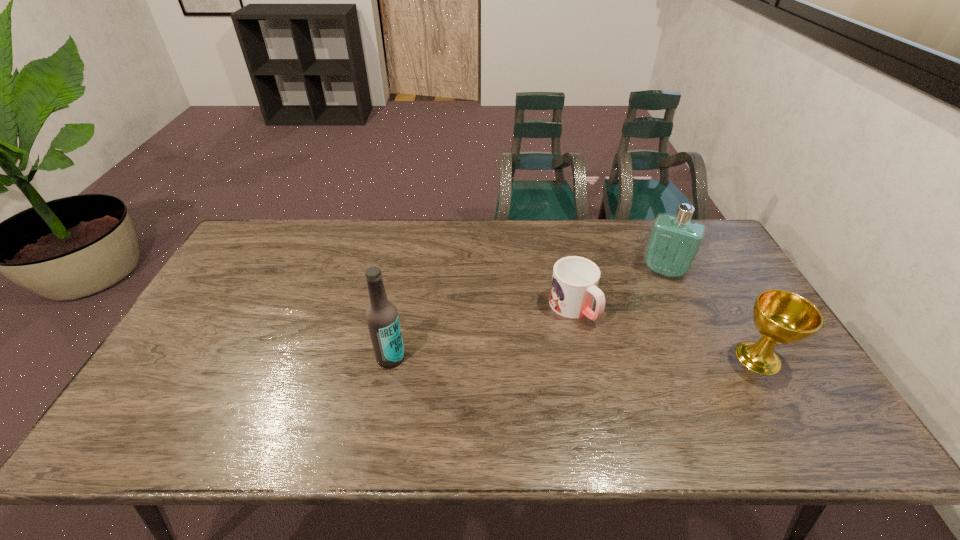
The image size is (960, 540). I want to click on free space on the desktop that is between the tallest object and the second shortest object and is positioned on the side of the third object from right to left with the handle, so (x=622, y=357).

Where is `free space on the desktop that is between the leftmost object and the second shortest object and is positioned on the front label of the perfume`? This screenshot has width=960, height=540. free space on the desktop that is between the leftmost object and the second shortest object and is positioned on the front label of the perfume is located at coordinates (629, 357).